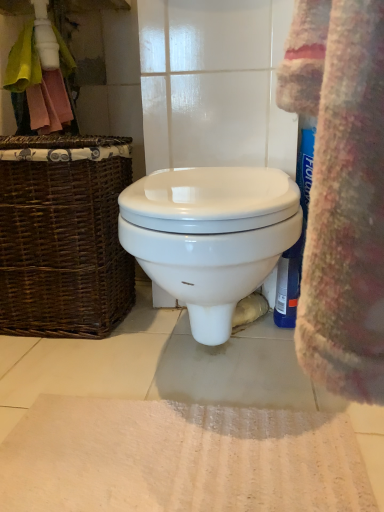
Question: Does brown wicker picnic basket at left come in front of white glossy toilet at center?

Choices:
 (A) yes
 (B) no

Answer: (B)

Question: Are brown wicker picnic basket at left and white glossy toilet at center far apart?

Choices:
 (A) yes
 (B) no

Answer: (B)

Question: From the image's perspective, is brown wicker picnic basket at left above white glossy toilet at center?

Choices:
 (A) no
 (B) yes

Answer: (B)

Question: Does brown wicker picnic basket at left have a lesser width compared to white glossy toilet at center?

Choices:
 (A) no
 (B) yes

Answer: (B)

Question: Considering the relative sizes of brown wicker picnic basket at left and white glossy toilet at center in the image provided, is brown wicker picnic basket at left smaller than white glossy toilet at center?

Choices:
 (A) yes
 (B) no

Answer: (B)

Question: From the image's perspective, is white textured bath mat at lower center positioned above or below white glossy toilet at center?

Choices:
 (A) below
 (B) above

Answer: (A)

Question: From a real-world perspective, relative to white glossy toilet at center, is white textured bath mat at lower center vertically above or below?

Choices:
 (A) above
 (B) below

Answer: (B)

Question: Is white textured bath mat at lower center in front of or behind white glossy toilet at center in the image?

Choices:
 (A) behind
 (B) front

Answer: (B)

Question: Visually, is white textured bath mat at lower center positioned to the left or to the right of white glossy toilet at center?

Choices:
 (A) right
 (B) left

Answer: (B)

Question: From their relative heights in the image, would you say white glossy toilet at center is taller or shorter than brown wicker picnic basket at left?

Choices:
 (A) tall
 (B) short

Answer: (B)

Question: From the image's perspective, is white glossy toilet at center positioned above or below brown wicker picnic basket at left?

Choices:
 (A) below
 (B) above

Answer: (A)

Question: Is point coord(231,181) closer or farther from the camera than point coord(64,296)?

Choices:
 (A) closer
 (B) farther

Answer: (A)

Question: Considering their positions, is white glossy toilet at center located in front of or behind brown wicker picnic basket at left?

Choices:
 (A) front
 (B) behind

Answer: (A)

Question: Considering the positions of brown wicker picnic basket at left and white glossy toilet at center in the image, is brown wicker picnic basket at left bigger or smaller than white glossy toilet at center?

Choices:
 (A) big
 (B) small

Answer: (A)

Question: Is brown wicker picnic basket at left to the left or to the right of white glossy toilet at center in the image?

Choices:
 (A) right
 (B) left

Answer: (B)